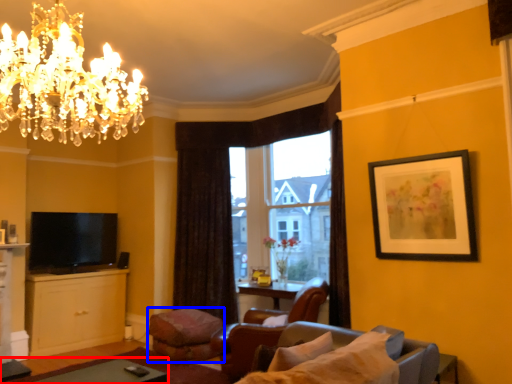
Question: Which of the following is the closest to the observer, table (highlighted by a red box) or footrest (highlighted by a blue box)?

Choices:
 (A) table
 (B) footrest

Answer: (A)